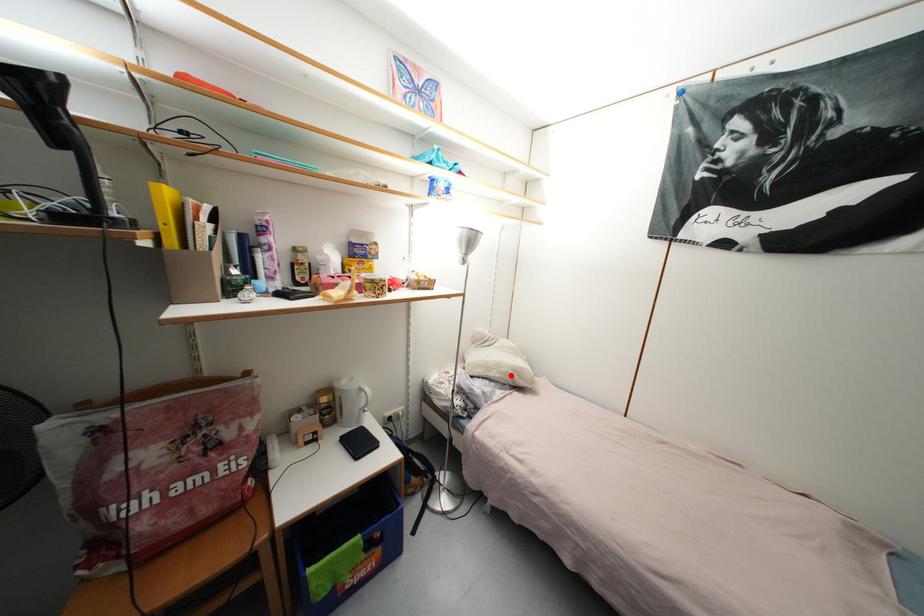
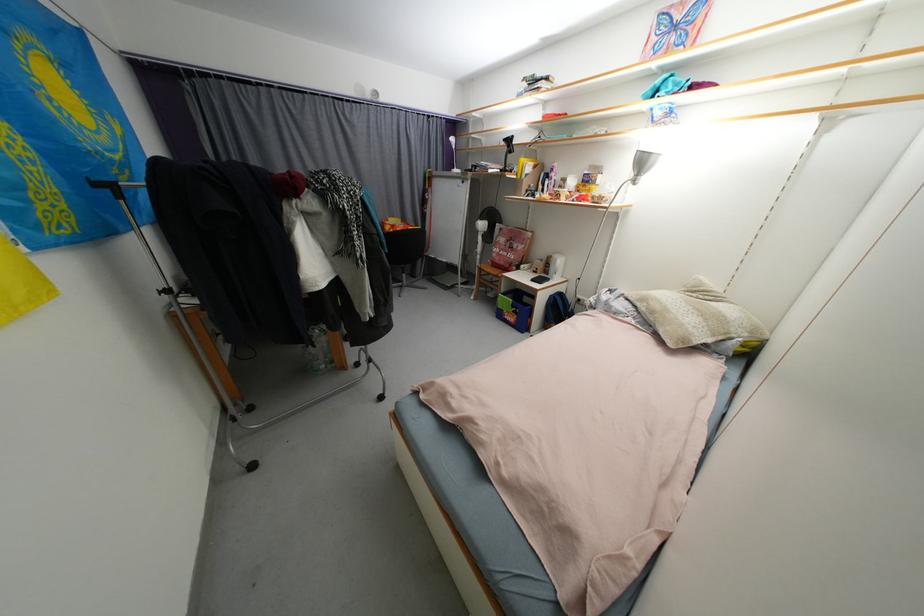
Question: I am providing you with two images of the same scene from different viewpoints. Image1 has a red point marked. In image2, the corresponding 3D location appears at what relative position? Reply with the corresponding letter.

Choices:
 (A) Closer
 (B) Farther

Answer: (A)